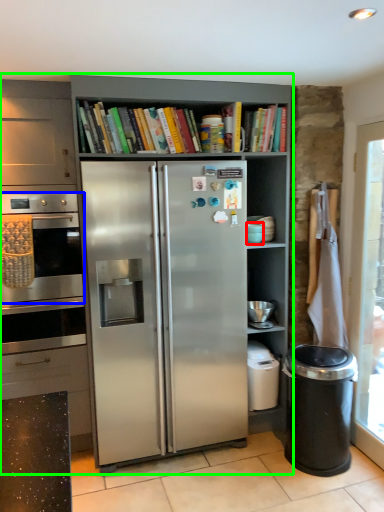
Question: Which object is the closest to the appliance (highlighted by a red box)? Choose among these: oven (highlighted by a blue box) or cupboard (highlighted by a green box).

Choices:
 (A) oven
 (B) cupboard

Answer: (B)